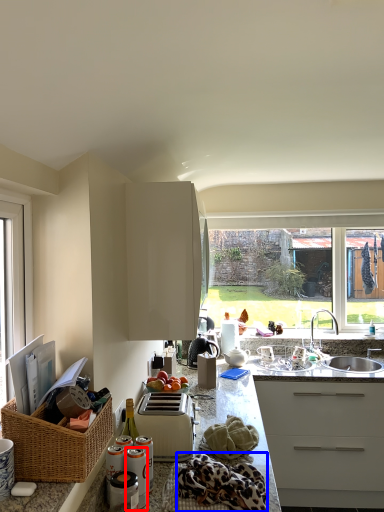
Question: Among these objects, which one is nearest to the camera, appliance (highlighted by a red box) or blanket (highlighted by a blue box)?

Choices:
 (A) appliance
 (B) blanket

Answer: (B)